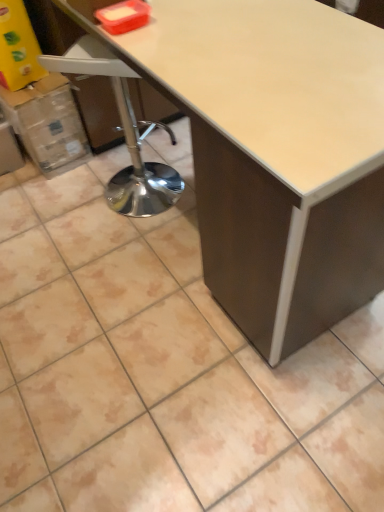
Question: Considering the positions of point (49, 161) and point (163, 89), is point (49, 161) closer or farther from the camera than point (163, 89)?

Choices:
 (A) farther
 (B) closer

Answer: (A)

Question: From a real-world perspective, is cardboard box at left above or below matte white table at center?

Choices:
 (A) above
 (B) below

Answer: (B)

Question: Estimate the real-world distances between objects in this image. Which object is farther from the matte white table at center?

Choices:
 (A) white plastic swivel chair at left
 (B) cardboard box at left

Answer: (B)

Question: Estimate the real-world distances between objects in this image. Which object is farther from the cardboard box at left?

Choices:
 (A) matte white table at center
 (B) white plastic swivel chair at left

Answer: (A)